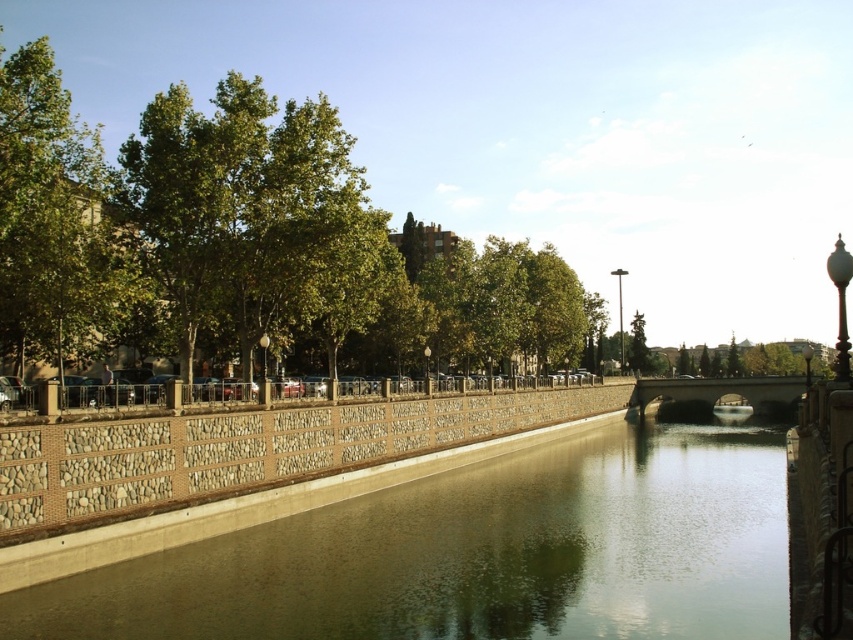
Question: Observing the image, what is the correct spatial positioning of smooth concrete river at center in reference to green leafy tree at upper left?

Choices:
 (A) above
 (B) below

Answer: (B)

Question: Which point is closer to the camera?

Choices:
 (A) (384, 227)
 (B) (115, 570)
 (C) (776, 394)
 (D) (28, 484)

Answer: (D)

Question: Which point is farther to the camera?

Choices:
 (A) (506, 422)
 (B) (669, 390)
 (C) (186, 97)
 (D) (775, 499)

Answer: (B)

Question: Is smooth concrete river at center further to the viewer compared to green leafy tree at upper left?

Choices:
 (A) yes
 (B) no

Answer: (B)

Question: Which object appears farthest from the camera in this image?

Choices:
 (A) smooth concrete river at center
 (B) concrete bridge at center
 (C) green leafy tree at upper left
 (D) brown stone fence at center

Answer: (B)

Question: Does brown stone fence at center have a greater width compared to concrete bridge at center?

Choices:
 (A) yes
 (B) no

Answer: (A)